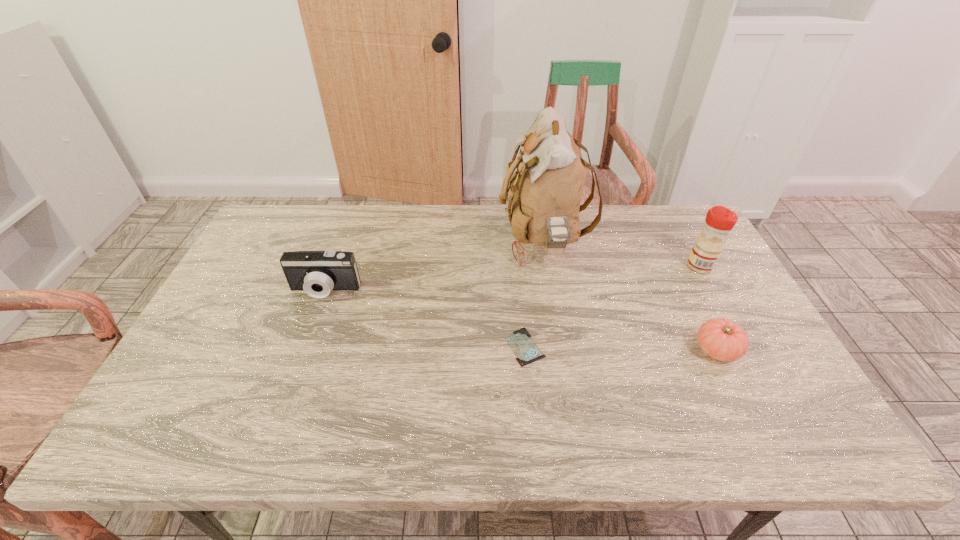
Where is `backpack`? The width and height of the screenshot is (960, 540). backpack is located at coordinates (545, 192).

This screenshot has height=540, width=960. Find the location of `the second tallest object`. the second tallest object is located at coordinates [719, 221].

I want to click on camcorder, so click(317, 273).

Locate an element on the screen. the third shortest object is located at coordinates (317, 273).

In order to click on tomato in this screenshot , I will do `click(721, 339)`.

Identify the location of identity card. (526, 351).

In order to click on free space located on the front-facing side of the backpack in this screenshot , I will do `click(425, 242)`.

Where is `free space located 0.270m on the front-facing side of the backpack`? The width and height of the screenshot is (960, 540). free space located 0.270m on the front-facing side of the backpack is located at coordinates (416, 242).

This screenshot has width=960, height=540. Find the location of `free spot located on the front-facing side of the backpack`. free spot located on the front-facing side of the backpack is located at coordinates (386, 242).

This screenshot has width=960, height=540. Find the location of `free space located 0.110m on the left of the second tallest object`. free space located 0.110m on the left of the second tallest object is located at coordinates (652, 266).